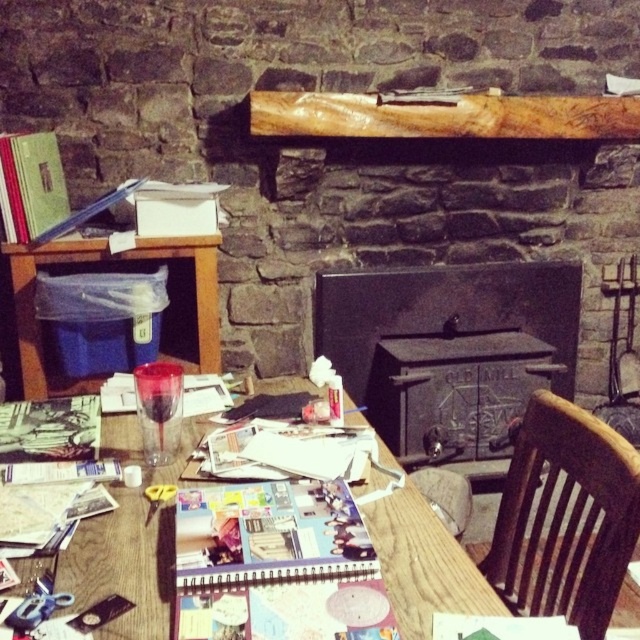
Question: Which object appears closest to the camera in this image?

Choices:
 (A) transparent plastic cup at lower left
 (B) brown wooden chair at lower right
 (C) wooden plank at upper center

Answer: (B)

Question: Which point is closer to the camera?

Choices:
 (A) wooden plank at upper center
 (B) transparent plastic cup at lower left
 (C) yellow plastic scissors at lower left

Answer: (C)

Question: Is transparent plastic cup at lower left above yellow plastic scissors at lower left?

Choices:
 (A) yes
 (B) no

Answer: (A)

Question: Can you confirm if brown wooden chair at lower right is wider than metallic scissors at lower left?

Choices:
 (A) yes
 (B) no

Answer: (A)

Question: Observing the image, what is the correct spatial positioning of brown wooden chair at lower right in reference to metallic scissors at lower left?

Choices:
 (A) right
 (B) left

Answer: (A)

Question: Which point is closer to the camera?

Choices:
 (A) metallic scissors at lower left
 (B) transparent plastic cup at lower left

Answer: (A)